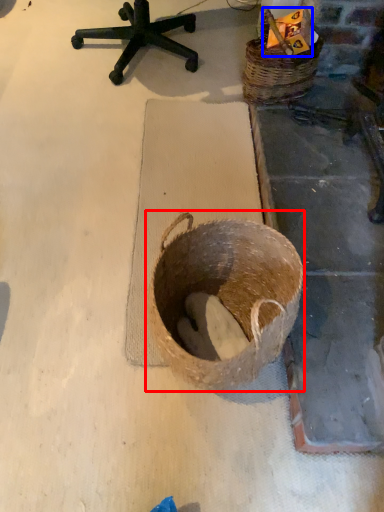
Question: Among these objects, which one is nearest to the camera, basket (highlighted by a red box) or scrap (highlighted by a blue box)?

Choices:
 (A) basket
 (B) scrap

Answer: (A)